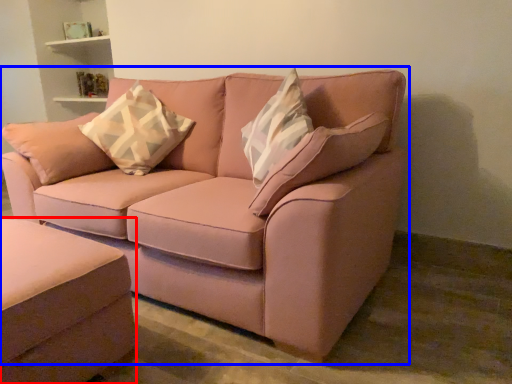
Question: Which of the following is the closest to the observer, studio couch (highlighted by a red box) or studio couch (highlighted by a blue box)?

Choices:
 (A) studio couch
 (B) studio couch

Answer: (A)